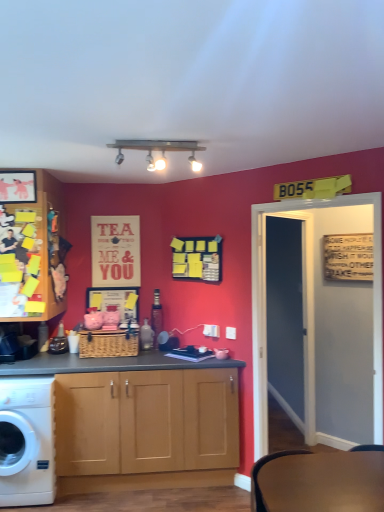
Image resolution: width=384 pixels, height=512 pixels. Find the location of `vacant area located to the right-hand side of white glossy washing machine at lower left`. vacant area located to the right-hand side of white glossy washing machine at lower left is located at coordinates (86, 499).